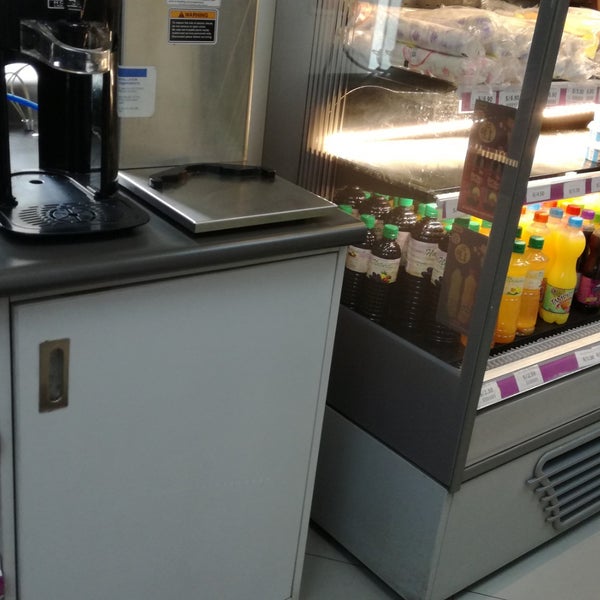
Image resolution: width=600 pixels, height=600 pixels. I want to click on commercial stainless steel coffee maker, so click(160, 152).